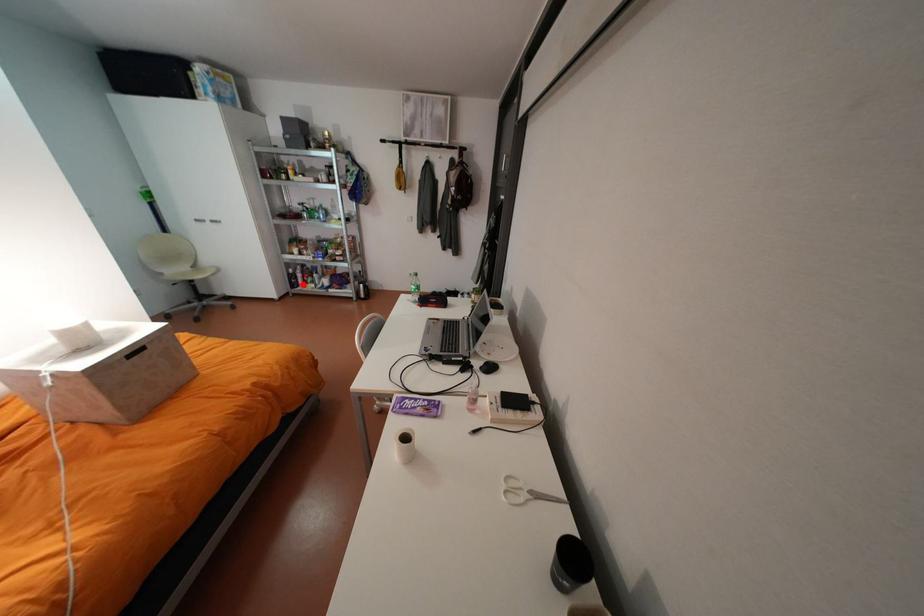
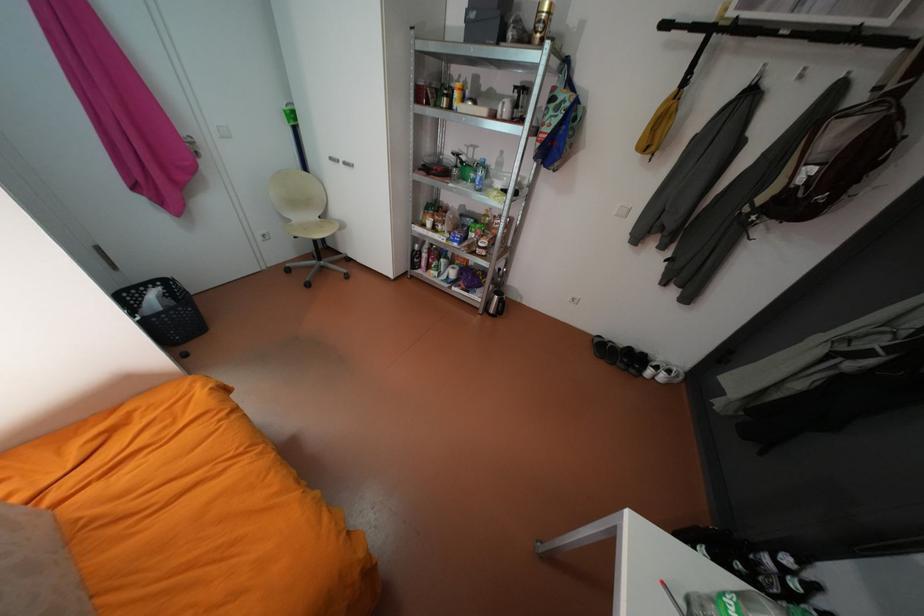
Question: I am providing you with two images of the same scene from different viewpoints. A red point is marked on the first image. At the location where the point appears in image 1, is it still visible in image 2?

Choices:
 (A) Yes
 (B) No

Answer: (A)